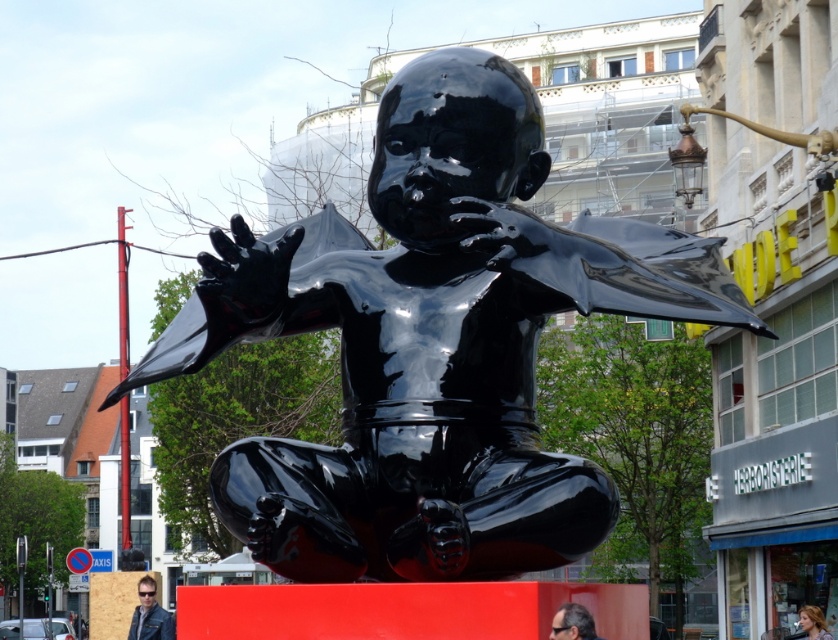
Which is more to the right, leather jacket at lower left or dark brown hair at lower center?

Positioned to the right is dark brown hair at lower center.

Is point (158, 636) farther from camera compared to point (577, 612)?

Yes, it is.

This screenshot has height=640, width=838. I want to click on leather jacket at lower left, so click(x=149, y=614).

Is leather jacket at lower left thinner than blonde hair at lower right?

Incorrect, leather jacket at lower left's width is not less than blonde hair at lower right's.

Is leather jacket at lower left bigger than blonde hair at lower right?

Correct, leather jacket at lower left is larger in size than blonde hair at lower right.

Which is behind, point (149, 636) or point (830, 637)?

Positioned behind is point (149, 636).

The image size is (838, 640). Identify the location of leather jacket at lower left. (149, 614).

Is glossy black baby at center taller than blonde hair at lower right?

Correct, glossy black baby at center is much taller as blonde hair at lower right.

Is point (688, 234) less distant than point (821, 634)?

Yes, it is in front of point (821, 634).

Locate an element on the screen. glossy black baby at center is located at coordinates (432, 344).